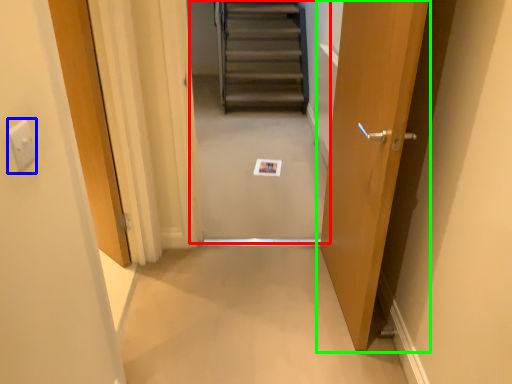
Question: Based on their relative distances, which object is nearer to escalator (highlighted by a red box)? Choose from electric outlet (highlighted by a blue box) and door (highlighted by a green box).

Choices:
 (A) electric outlet
 (B) door

Answer: (B)